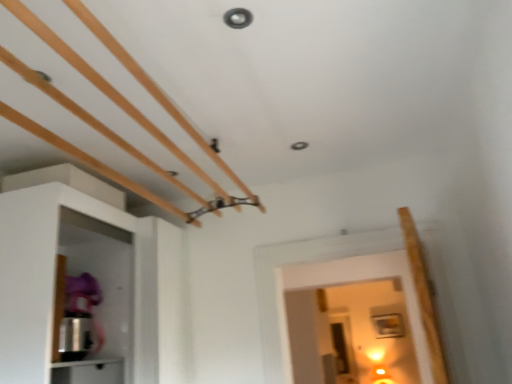
Question: In terms of size, does white matte cabinet at left, which appears as the 1th cabinetry when viewed from the top, appear bigger or smaller than white glossy cabinet at lower left, the second cabinetry viewed from the top?

Choices:
 (A) small
 (B) big

Answer: (B)

Question: Considering their positions, is white matte cabinet at left, the second cabinetry from the bottom, located in front of or behind white glossy cabinet at lower left, the second cabinetry viewed from the top?

Choices:
 (A) behind
 (B) front

Answer: (B)

Question: Is point (122, 319) closer or farther from the camera than point (75, 374)?

Choices:
 (A) closer
 (B) farther

Answer: (B)

Question: Considering the relative positions of white glossy cabinet at lower left, the second cabinetry viewed from the top, and white matte cabinet at left, the second cabinetry from the bottom, in the image provided, is white glossy cabinet at lower left, the second cabinetry viewed from the top, to the left or to the right of white matte cabinet at left, the second cabinetry from the bottom,?

Choices:
 (A) right
 (B) left

Answer: (A)

Question: From a real-world perspective, is white glossy cabinet at lower left, the first cabinetry from the bottom, above or below white matte cabinet at left, the second cabinetry from the bottom?

Choices:
 (A) below
 (B) above

Answer: (A)

Question: From the image's perspective, is white glossy cabinet at lower left, the first cabinetry from the bottom, located above or below white matte cabinet at left, the second cabinetry from the bottom?

Choices:
 (A) above
 (B) below

Answer: (B)

Question: Relative to white matte cabinet at left, the second cabinetry from the bottom, is white glossy cabinet at lower left, the first cabinetry from the bottom, in front or behind?

Choices:
 (A) front
 (B) behind

Answer: (B)